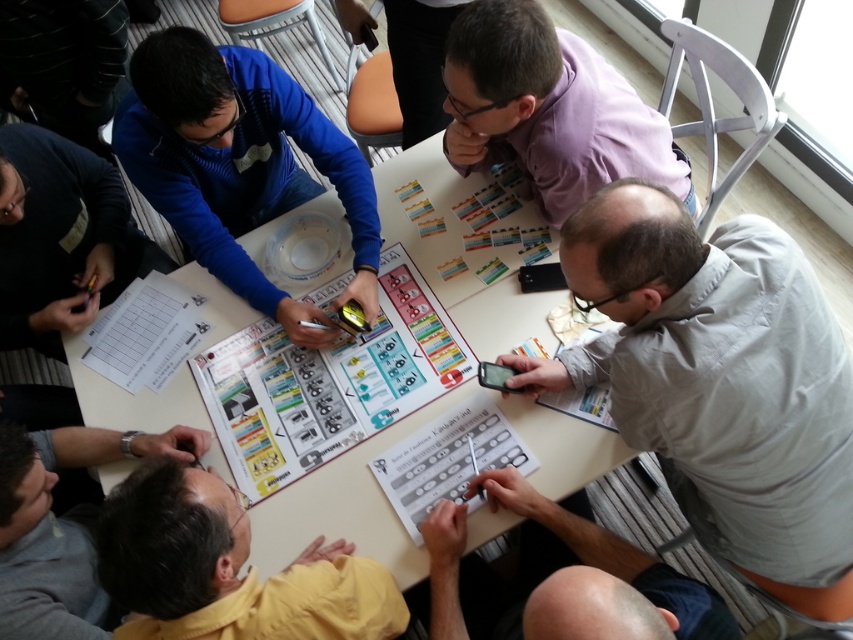
Can you confirm if gray fabric shirt at lower right is smaller than purple matte shirt at upper center?

No.

Image resolution: width=853 pixels, height=640 pixels. What do you see at coordinates (720, 381) in the screenshot?
I see `gray fabric shirt at lower right` at bounding box center [720, 381].

Is point (642, 419) farther from viewer compared to point (587, 125)?

No.

Where is `gray fabric shirt at lower right`? gray fabric shirt at lower right is located at coordinates click(720, 381).

Between smooth gray shirt at lower right and yellow shirt at lower left, which one is positioned higher?

Positioned higher is yellow shirt at lower left.

Is smooth gray shirt at lower right shorter than yellow shirt at lower left?

Correct, smooth gray shirt at lower right is not as tall as yellow shirt at lower left.

What do you see at coordinates (595, 572) in the screenshot? I see `smooth gray shirt at lower right` at bounding box center [595, 572].

Where is `smooth gray shirt at lower right`? The image size is (853, 640). smooth gray shirt at lower right is located at coordinates (595, 572).

Can you confirm if gray fabric shirt at lower right is shorter than matte plastic board game at center?

No.

Does gray fabric shirt at lower right have a larger size compared to matte plastic board game at center?

Correct, gray fabric shirt at lower right is larger in size than matte plastic board game at center.

Where is `gray fabric shirt at lower right`? gray fabric shirt at lower right is located at coordinates (720, 381).

The height and width of the screenshot is (640, 853). What are the coordinates of `gray fabric shirt at lower right` in the screenshot? It's located at point(720,381).